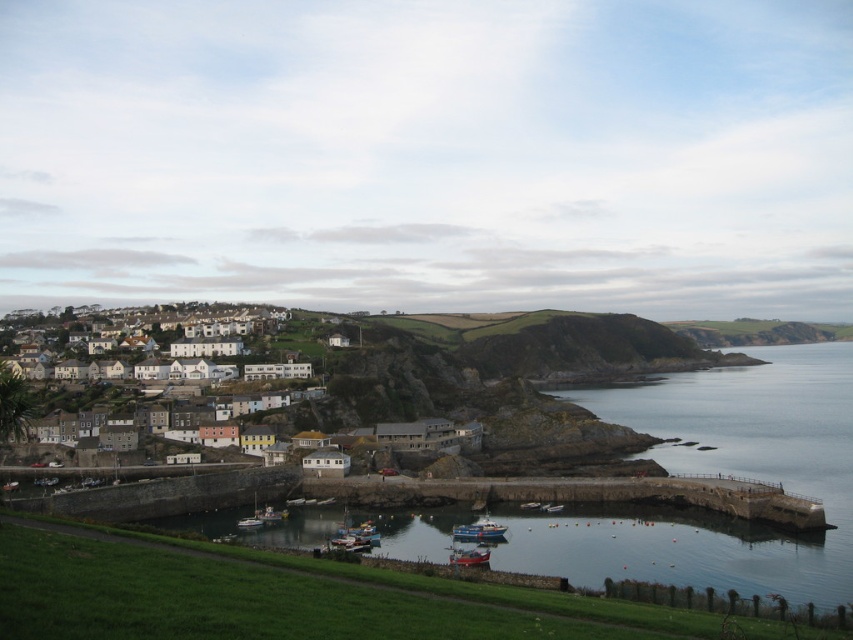
Question: In this image, where is white stone houses at left located relative to metallic blue boat at lower center?

Choices:
 (A) below
 (B) above

Answer: (B)

Question: Considering the real-world distances, which object is closest to the blue metallic boat at center?

Choices:
 (A) red plastic boat at lower center
 (B) white stone houses at left
 (C) metallic blue boat at lower center

Answer: (A)

Question: Which is farther from the metallic blue boat at lower center?

Choices:
 (A) white stone houses at left
 (B) white plastic boat at lower center
 (C) red plastic boat at lower center
 (D) blue metallic boat at center

Answer: (A)

Question: Is white plastic boat at lower center thinner than metallic blue boat at lower center?

Choices:
 (A) yes
 (B) no

Answer: (B)

Question: From the image, what is the correct spatial relationship of blue metallic boat at center in relation to metallic blue boat at lower center?

Choices:
 (A) left
 (B) right

Answer: (B)

Question: Among these objects, which one is nearest to the camera?

Choices:
 (A) white stone houses at left
 (B) white plastic boat at lower center
 (C) blue metallic boat at center
 (D) red plastic boat at lower center

Answer: (A)